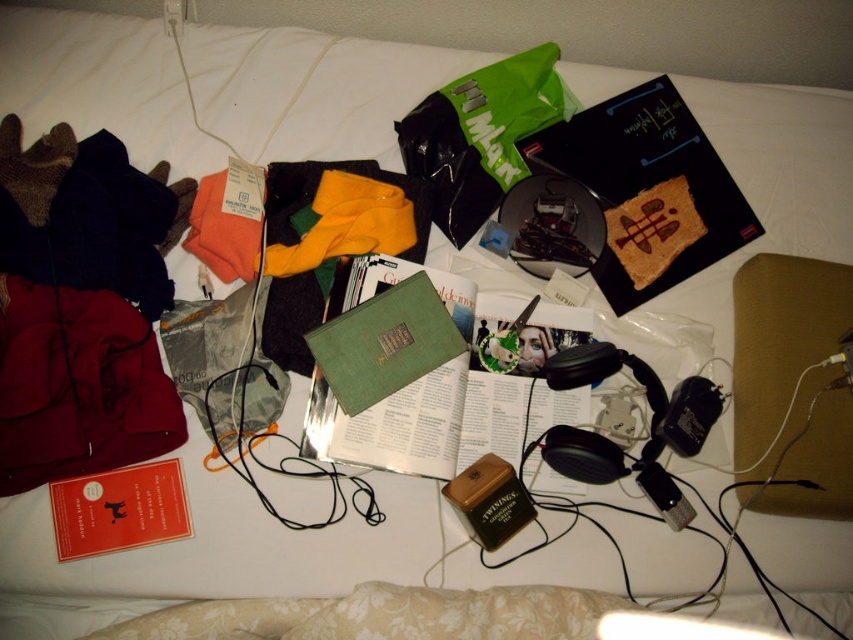
You are organizing items on a bed and need to place a new item between the green matte book at center and the dark red fabric at left. Where should you place it?

Since the green matte book at center is to the right of the dark red fabric at left, you should place the new item between them, ensuring it is positioned to the right of the dark red fabric at left and to the left of the green matte book at center.

You are organizing a shelf and have two books to place. You have a green matte book at center and a hardcover book at center. Which book should you place first if you want to arrange them from smallest to largest?

The green matte book at center should be placed first since it is smaller than the hardcover book at center.

You are looking at the image and want to determine which of the two points, point (467, 369) or point (683, 253), is closer to you. Based on the information provided, which point is nearer?

Point (467, 369) is closer to the camera than point (683, 253).